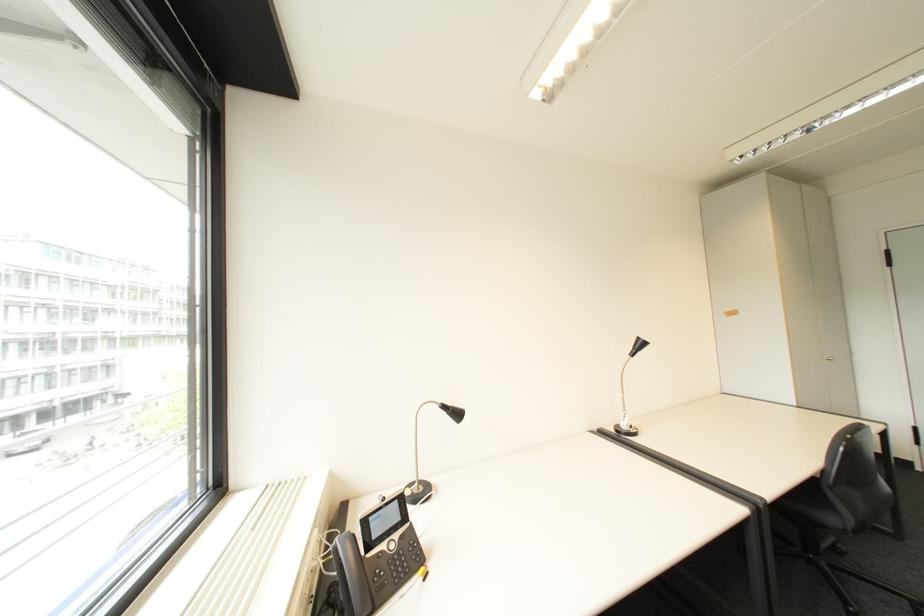
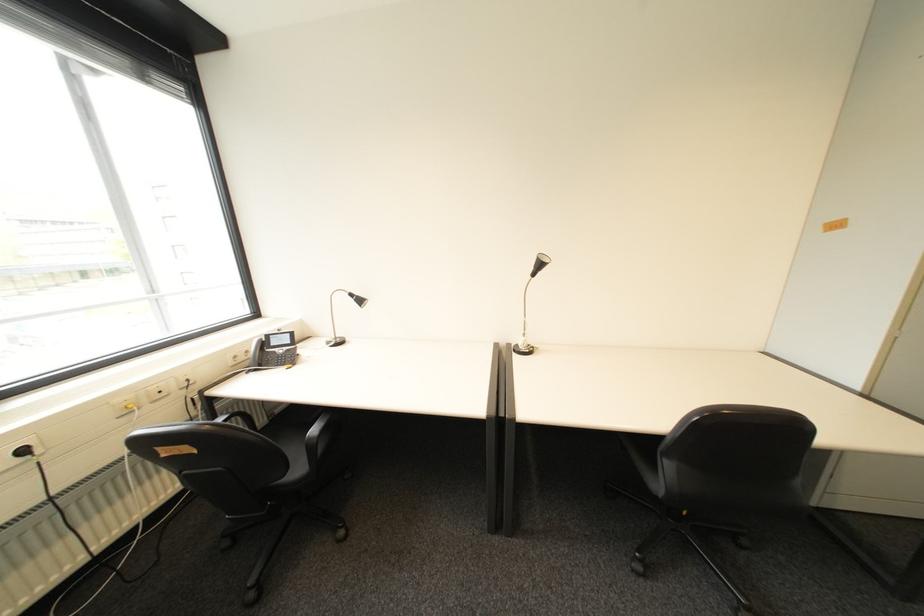
In the second image, find the point that corresponds to (x=629, y=427) in the first image.

(528, 345)